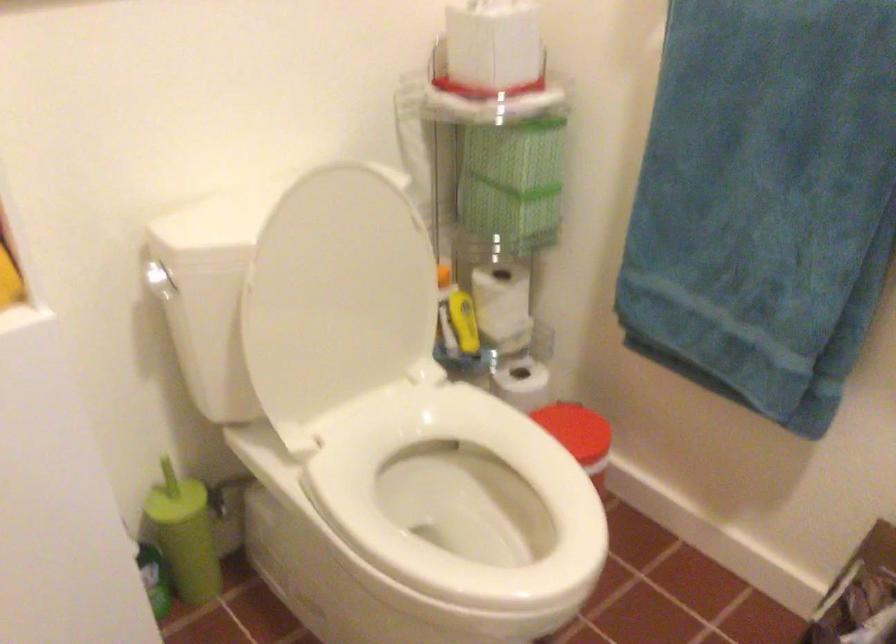
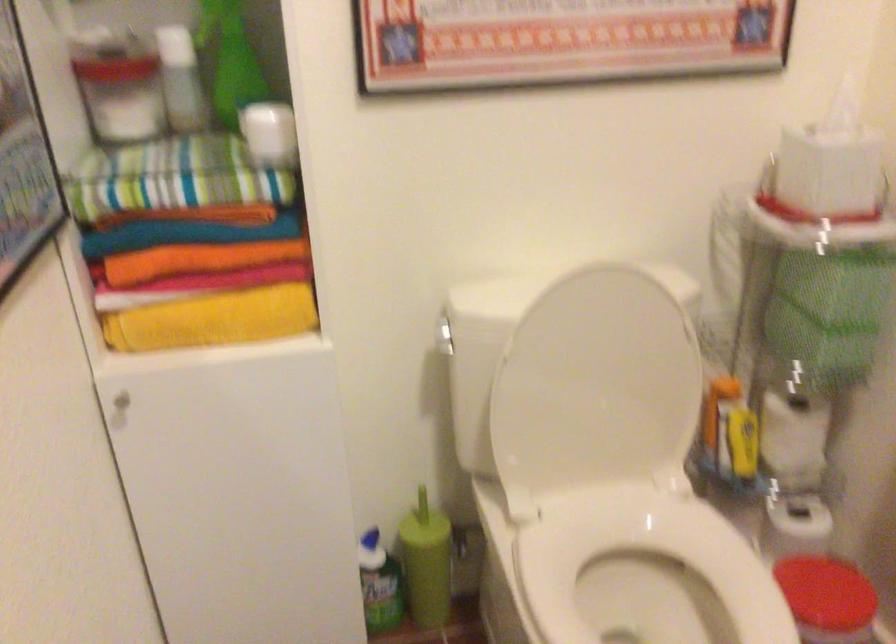
The point at (188, 538) is marked in the first image. Where is the corresponding point in the second image?

(426, 563)